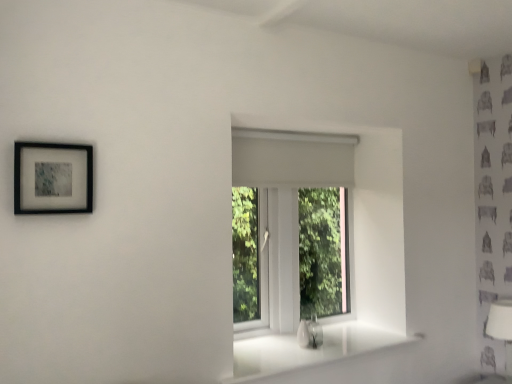
Identify the location of empty space that is to the right of white glossy sink at lower center. The height and width of the screenshot is (384, 512). (336, 345).